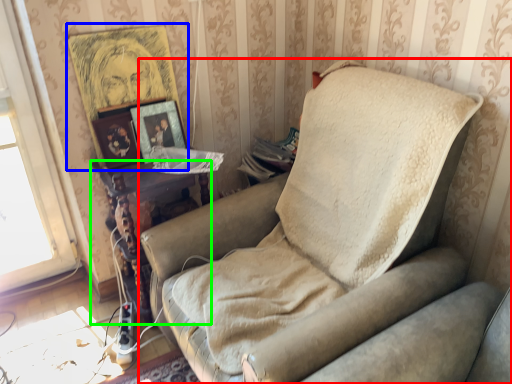
Question: Which is nearer to the studio couch (highlighted by a red box)? picture frame (highlighted by a blue box) or table (highlighted by a green box).

Choices:
 (A) picture frame
 (B) table

Answer: (B)